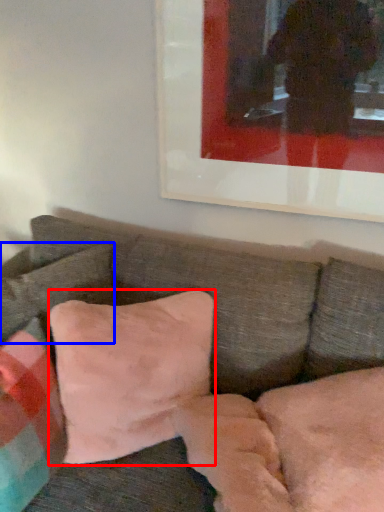
Question: Which point is closer to the camera, pillow (highlighted by a red box) or pillow (highlighted by a blue box)?

Choices:
 (A) pillow
 (B) pillow

Answer: (A)